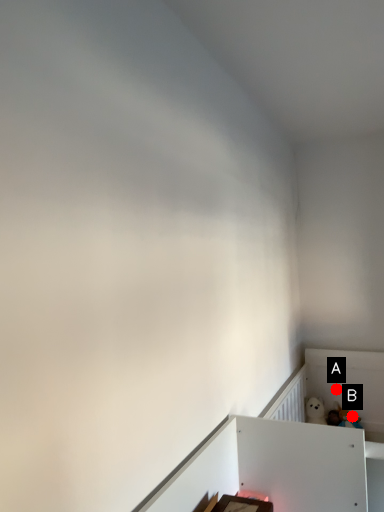
Question: Two points are circled on the image, labeled by A and B beside each circle. Which point is farther from the camera taking this photo?

Choices:
 (A) A is further
 (B) B is further

Answer: (A)